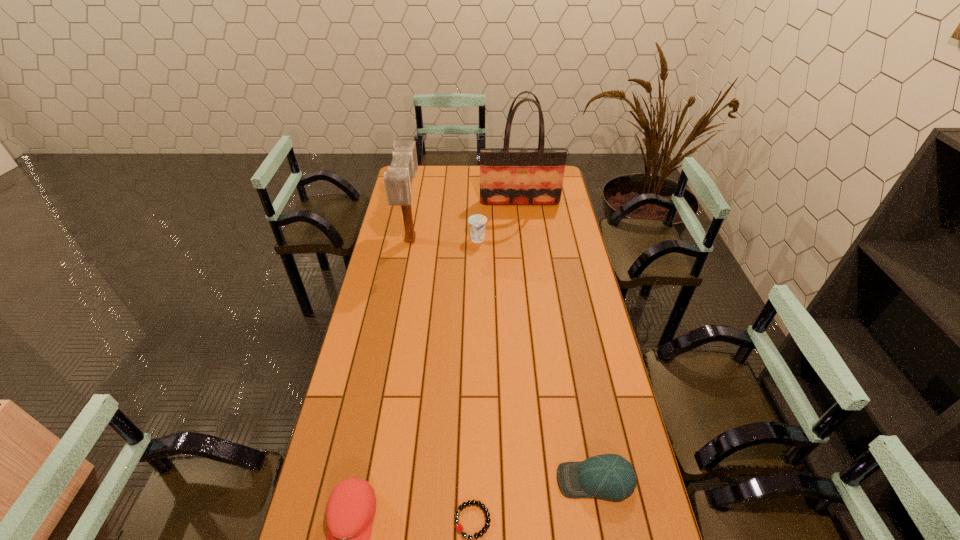
Locate an element on the screen. the farthest object is located at coordinates (508, 176).

You are a GUI agent. You are given a task and a screenshot of the screen. Output one action in this format:
    pyautogui.click(x=<x>, y=<y>)
    Task: Click on the tallest object
    The image size is (960, 540).
    Given the screenshot: What is the action you would take?
    point(508,176)

Locate an element on the screen. This screenshot has width=960, height=540. the fifth shortest object is located at coordinates (398, 180).

Where is `the fourth shortest object`? The image size is (960, 540). the fourth shortest object is located at coordinates (477, 222).

The height and width of the screenshot is (540, 960). I want to click on baseball cap, so click(x=611, y=477).

Where is `vacant space located 0.130m on the front-facing side of the tallest object`? vacant space located 0.130m on the front-facing side of the tallest object is located at coordinates tap(522, 224).

This screenshot has height=540, width=960. In order to click on vacant region located 0.050m on the right of the second tallest object in this screenshot , I will do `click(432, 239)`.

Locate an element on the screen. The image size is (960, 540). free space located 0.370m on the left of the fourth shortest object is located at coordinates pos(386,240).

Where is `vacant point located 0.400m on the left of the baseball cap`? Image resolution: width=960 pixels, height=540 pixels. vacant point located 0.400m on the left of the baseball cap is located at coordinates (412, 480).

You are a GUI agent. You are given a task and a screenshot of the screen. Output one action in this format:
    pyautogui.click(x=<x>, y=<y>)
    Task: Click on the object present at the left edge
    The height and width of the screenshot is (540, 960).
    Given the screenshot: What is the action you would take?
    pyautogui.click(x=398, y=180)